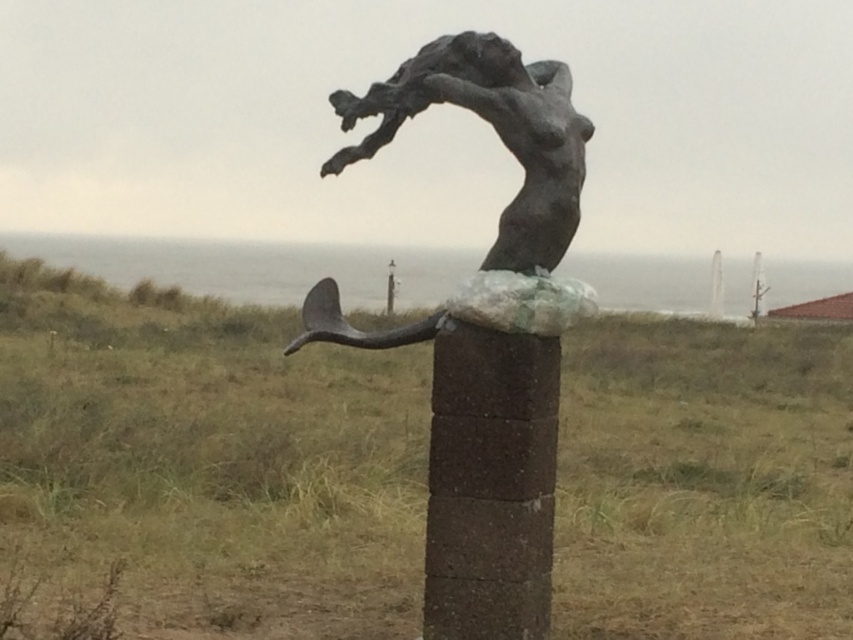
Measure the distance from bronze mermaid at center to bronze sculpture at center.

bronze mermaid at center is 4.18 centimeters from bronze sculpture at center.

Does bronze mermaid at center have a greater width compared to bronze sculpture at center?

Indeed, bronze mermaid at center has a greater width compared to bronze sculpture at center.

Is point (503, 134) more distant than point (486, 260)?

No, it is not.

Identify the location of bronze mermaid at center. (495, 131).

Does brown stone pole at center have a smaller size compared to bronze mermaid at center?

Yes, brown stone pole at center is smaller than bronze mermaid at center.

Is the position of brown stone pole at center more distant than that of bronze mermaid at center?

No.

Locate an element on the screen. brown stone pole at center is located at coordinates (490, 484).

Which is more to the left, brown stone pole at center or bronze sculpture at center?

From the viewer's perspective, brown stone pole at center appears more on the left side.

Is brown stone pole at center shorter than bronze sculpture at center?

Incorrect, brown stone pole at center's height does not fall short of bronze sculpture at center's.

Describe the element at coordinates (490, 484) in the screenshot. I see `brown stone pole at center` at that location.

Identify the location of brown stone pole at center. (490, 484).